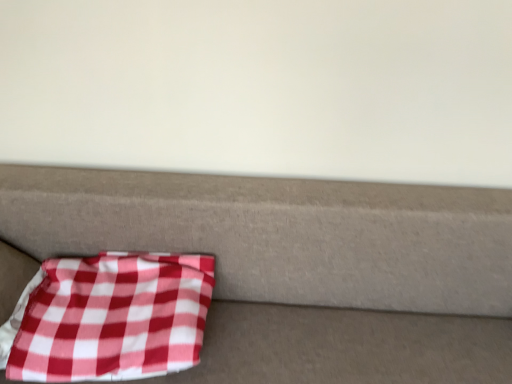
Question: From a real-world perspective, is red checkered fabric at lower left located higher than red checkered fabric at lower left?

Choices:
 (A) yes
 (B) no

Answer: (A)

Question: Can we say red checkered fabric at lower left lies outside red checkered fabric at lower left?

Choices:
 (A) yes
 (B) no

Answer: (B)

Question: Is red checkered fabric at lower left taller than red checkered fabric at lower left?

Choices:
 (A) yes
 (B) no

Answer: (B)

Question: Is red checkered fabric at lower left further to camera compared to red checkered fabric at lower left?

Choices:
 (A) no
 (B) yes

Answer: (B)

Question: From the image's perspective, is red checkered fabric at lower left under red checkered fabric at lower left?

Choices:
 (A) no
 (B) yes

Answer: (A)

Question: Is red checkered fabric at lower left positioned in front of red checkered fabric at lower left?

Choices:
 (A) yes
 (B) no

Answer: (B)

Question: Is red checkered fabric at lower left in front of red checkered fabric at lower left?

Choices:
 (A) no
 (B) yes

Answer: (B)

Question: Can you confirm if red checkered fabric at lower left is positioned to the right of red checkered fabric at lower left?

Choices:
 (A) no
 (B) yes

Answer: (B)

Question: Can you confirm if red checkered fabric at lower left is thinner than red checkered fabric at lower left?

Choices:
 (A) yes
 (B) no

Answer: (B)

Question: Does red checkered fabric at lower left touch red checkered fabric at lower left?

Choices:
 (A) yes
 (B) no

Answer: (B)

Question: From the image's perspective, is red checkered fabric at lower left under red checkered fabric at lower left?

Choices:
 (A) no
 (B) yes

Answer: (B)

Question: From a real-world perspective, is red checkered fabric at lower left physically below red checkered fabric at lower left?

Choices:
 (A) no
 (B) yes

Answer: (B)

Question: Does point (172, 327) appear closer or farther from the camera than point (438, 236)?

Choices:
 (A) farther
 (B) closer

Answer: (B)